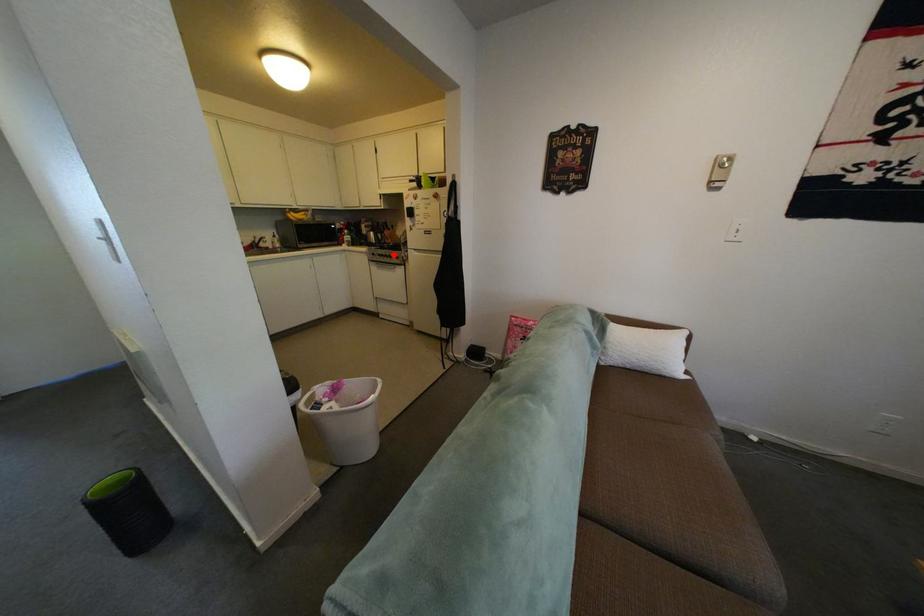
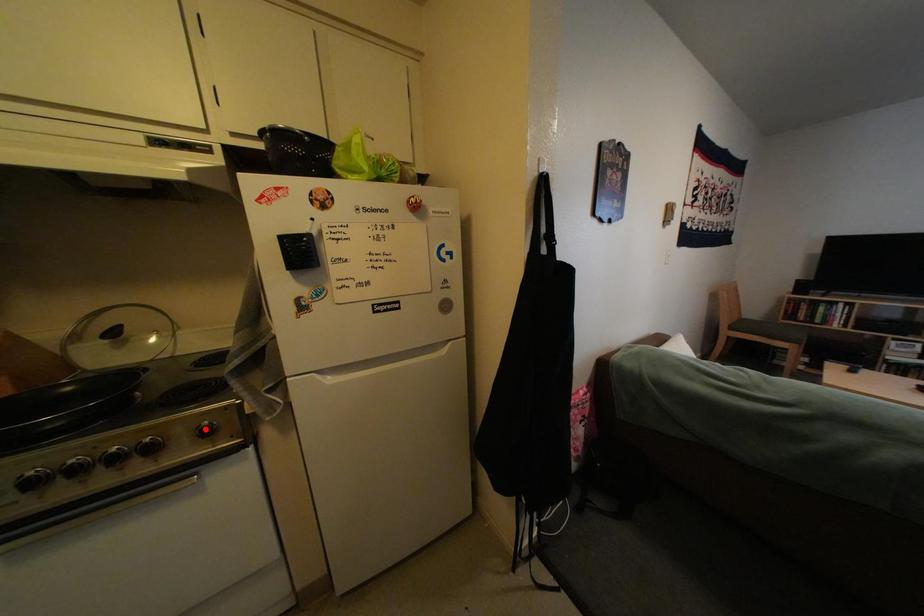
I am providing you with two images of the same scene from different viewpoints. A red point is marked on the first image and another point is marked on the second image. Does the point marked in image1 correspond to the same location as the one in image2?

No